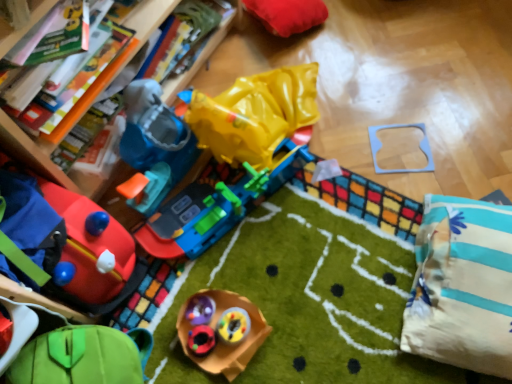
Locate an element on the screen. This screenshot has width=512, height=384. green fabric toy at lower left, positioned as the 1th toy in bottom-to-top order is located at coordinates (83, 356).

How much space does wooden puzzle piece at upper center, the 2th toy in the top-to-bottom sequence, occupy vertically?

2.56 centimeters.

The height and width of the screenshot is (384, 512). What do you see at coordinates (222, 343) in the screenshot? I see `rubberized plastic toy at center, the fourth toy in the top-to-bottom sequence` at bounding box center [222, 343].

Describe the element at coordinates (287, 14) in the screenshot. I see `velvet red cushion at upper center, arranged as the first toy when viewed from the top` at that location.

The image size is (512, 384). In order to click on wooden bookshelf at upper left in this screenshot , I will do `click(32, 152)`.

From the image's perspective, which is above, rubberized plastic toy at center, the fourth toy in the bottom-to-top sequence, or green fabric toy at lower left, positioned as the 1th toy in bottom-to-top order?

rubberized plastic toy at center, the fourth toy in the bottom-to-top sequence, is shown above in the image.

Which point is more distant from viewer, (231, 299) or (147, 353)?

The point (231, 299) is farther from the camera.

In the scene shown: How distant is rubberized plastic toy at center, the fourth toy in the bottom-to-top sequence, from green fabric toy at lower left, positioned as the 1th toy in bottom-to-top order?

8.76 inches.

The width and height of the screenshot is (512, 384). In order to click on pillow that is above the rubberized plastic toy at center, the fourth toy in the bottom-to-top sequence (from the image's perspective) in this screenshot , I will do `click(462, 286)`.

In the image, is rubberized plastic toy at center, the fourth toy in the bottom-to-top sequence, on the left side or the right side of white striped pillow at lower right?

rubberized plastic toy at center, the fourth toy in the bottom-to-top sequence, is to the left of white striped pillow at lower right.

Does rubberized plastic toy at center, the fourth toy in the bottom-to-top sequence, lie in front of white striped pillow at lower right?

No, rubberized plastic toy at center, the fourth toy in the bottom-to-top sequence, is further to the viewer.

Would you say rubberized plastic toy at center, the fourth toy in the bottom-to-top sequence, is inside or outside white striped pillow at lower right?

The correct answer is: outside.

From the image's perspective, is wooden bookshelf at upper left positioned above or below velvet red cushion at upper center, arranged as the first toy when viewed from the top?

wooden bookshelf at upper left is situated lower than velvet red cushion at upper center, arranged as the first toy when viewed from the top, in the image.

From a real-world perspective, is wooden bookshelf at upper left over velvet red cushion at upper center, marked as the seventh toy in a bottom-to-top arrangement?

Yes, from a real-world perspective, wooden bookshelf at upper left is on top of velvet red cushion at upper center, marked as the seventh toy in a bottom-to-top arrangement.

Between wooden bookshelf at upper left and velvet red cushion at upper center, marked as the seventh toy in a bottom-to-top arrangement, which one has smaller size?

Smaller between the two is velvet red cushion at upper center, marked as the seventh toy in a bottom-to-top arrangement.

Which point is more distant from viewer, (47, 141) or (270, 31)?

Point (270, 31)

Between point (23, 367) and point (433, 198), which one is positioned behind?

The point (433, 198) is farther.

Considering the sizes of green fabric toy at lower left, positioned as the 1th toy in bottom-to-top order, and white striped pillow at lower right in the image, is green fabric toy at lower left, positioned as the 1th toy in bottom-to-top order, bigger or smaller than white striped pillow at lower right?

Considering their sizes, green fabric toy at lower left, positioned as the 1th toy in bottom-to-top order, takes up less space than white striped pillow at lower right.

From the image's perspective, is green fabric toy at lower left, positioned as the 1th toy in bottom-to-top order, under white striped pillow at lower right?

Yes, from the image's perspective, green fabric toy at lower left, positioned as the 1th toy in bottom-to-top order, is below white striped pillow at lower right.

Which object is positioned more to the left, green fabric toy at lower left, positioned as the 1th toy in bottom-to-top order, or white striped pillow at lower right?

Positioned to the left is green fabric toy at lower left, positioned as the 1th toy in bottom-to-top order.

The width and height of the screenshot is (512, 384). I want to click on the 3rd toy above the rubberized plastic toy at center, the fourth toy in the bottom-to-top sequence (from the image's perspective), so click(287, 14).

Between velvet red cushion at upper center, arranged as the first toy when viewed from the top, and rubberized plastic toy at center, the fourth toy in the top-to-bottom sequence, which one appears on the left side from the viewer's perspective?

rubberized plastic toy at center, the fourth toy in the top-to-bottom sequence.

How distant is velvet red cushion at upper center, arranged as the first toy when viewed from the top, from rubberized plastic toy at center, the fourth toy in the top-to-bottom sequence?

velvet red cushion at upper center, arranged as the first toy when viewed from the top, is 36.10 inches away from rubberized plastic toy at center, the fourth toy in the top-to-bottom sequence.

From the image's perspective, is velvet red cushion at upper center, arranged as the first toy when viewed from the top, positioned above or below rubberized plastic toy at center, the fourth toy in the bottom-to-top sequence?

velvet red cushion at upper center, arranged as the first toy when viewed from the top, is above rubberized plastic toy at center, the fourth toy in the bottom-to-top sequence.

From a real-world perspective, which object rests below the other?

In real-world perspective, rubberized red car at lower left, the fifth toy from the bottom, is lower.

Which object is positioned more to the left, rubberized red car at lower left, arranged as the third toy when viewed from the top, or wooden bookshelf at upper left?

rubberized red car at lower left, arranged as the third toy when viewed from the top.

The image size is (512, 384). What are the coordinates of `toy on the left side of green fabric toy at lower left, the 7th toy in the top-to-bottom sequence` in the screenshot? It's located at pos(70,243).

Between green fabric toy at lower left, positioned as the 1th toy in bottom-to-top order, and rubberized red car at lower left, the fifth toy from the bottom, which one has smaller width?

green fabric toy at lower left, positioned as the 1th toy in bottom-to-top order, is thinner.

From the image's perspective, is green fabric toy at lower left, positioned as the 1th toy in bottom-to-top order, above or below rubberized red car at lower left, the fifth toy from the bottom?

From the image's perspective, green fabric toy at lower left, positioned as the 1th toy in bottom-to-top order, appears below rubberized red car at lower left, the fifth toy from the bottom.

From a real-world perspective, does green fabric toy at lower left, the 7th toy in the top-to-bottom sequence, sit lower than rubberized red car at lower left, the fifth toy from the bottom?

Yes.

In order to click on the 3rd toy positioned above the green fabric toy at lower left, positioned as the 1th toy in bottom-to-top order (from the image's perspective) in this screenshot , I will do `click(222, 343)`.

From a real-world perspective, count 3rd toys downward from the white striped pillow at lower right and point to it. Please provide its 2D coordinates.

[(222, 343)]

Considering their positions, is rubberized plastic toy at center, the 5th toy when ordered from top to bottom, positioned further to rubberized plastic toy at center, the fourth toy in the bottom-to-top sequence, than wooden puzzle piece at upper center, the 2th toy in the top-to-bottom sequence?

wooden puzzle piece at upper center, the 2th toy in the top-to-bottom sequence.

In the scene shown: Looking at the image, which one is located closer to rubberized plastic toy at center, placed as the second toy when sorted from bottom to top, rubberized plastic toy at center, the 5th toy when ordered from top to bottom, or wooden bookshelf at upper left?

rubberized plastic toy at center, the 5th toy when ordered from top to bottom, is closer to rubberized plastic toy at center, placed as the second toy when sorted from bottom to top.

Based on their spatial positions, is white striped pillow at lower right or wooden bookshelf at upper left further from rubberized plastic toy at center, the fourth toy in the bottom-to-top sequence?

The object further to rubberized plastic toy at center, the fourth toy in the bottom-to-top sequence, is wooden bookshelf at upper left.

When comparing their distances from rubberized red car at lower left, arranged as the third toy when viewed from the top, does rubberized plastic toy at center, the fourth toy in the top-to-bottom sequence, or wooden bookshelf at upper left seem further?

The object further to rubberized red car at lower left, arranged as the third toy when viewed from the top, is rubberized plastic toy at center, the fourth toy in the top-to-bottom sequence.

Looking at the image, which one is located further to rubberized red car at lower left, arranged as the third toy when viewed from the top, rubberized plastic toy at center, the 5th toy when ordered from top to bottom, or rubberized plastic toy at center, the sixth toy from the top?

rubberized plastic toy at center, the 5th toy when ordered from top to bottom.

Considering their positions, is rubberized red car at lower left, the fifth toy from the bottom, positioned closer to wooden puzzle piece at upper center, the 6th toy when ordered from bottom to top, than rubberized plastic toy at center, placed as the second toy when sorted from bottom to top?

The object closer to wooden puzzle piece at upper center, the 6th toy when ordered from bottom to top, is rubberized plastic toy at center, placed as the second toy when sorted from bottom to top.

Which object lies further to the anchor point rubberized plastic toy at center, the fourth toy in the bottom-to-top sequence, wooden puzzle piece at upper center, the 2th toy in the top-to-bottom sequence, or green fabric toy at lower left, positioned as the 1th toy in bottom-to-top order?

wooden puzzle piece at upper center, the 2th toy in the top-to-bottom sequence, is further to rubberized plastic toy at center, the fourth toy in the bottom-to-top sequence.

When comparing their distances from wooden puzzle piece at upper center, the 6th toy when ordered from bottom to top, does rubberized red car at lower left, arranged as the third toy when viewed from the top, or rubberized plastic toy at center, the 5th toy when ordered from top to bottom, seem further?

rubberized red car at lower left, arranged as the third toy when viewed from the top, lies further to wooden puzzle piece at upper center, the 6th toy when ordered from bottom to top, than the other object.

The width and height of the screenshot is (512, 384). Find the location of `toy between green fabric toy at lower left, the 7th toy in the top-to-bottom sequence, and rubberized plastic toy at center, the fourth toy in the bottom-to-top sequence`. toy between green fabric toy at lower left, the 7th toy in the top-to-bottom sequence, and rubberized plastic toy at center, the fourth toy in the bottom-to-top sequence is located at coordinates coord(201,340).

The image size is (512, 384). Find the location of `bookcase that lies between velvet red cushion at upper center, marked as the seventh toy in a bottom-to-top arrangement, and rubberized plastic toy at center, the fourth toy in the top-to-bottom sequence, from top to bottom`. bookcase that lies between velvet red cushion at upper center, marked as the seventh toy in a bottom-to-top arrangement, and rubberized plastic toy at center, the fourth toy in the top-to-bottom sequence, from top to bottom is located at coordinates (32, 152).

Identify the location of bookcase between velvet red cushion at upper center, marked as the seventh toy in a bottom-to-top arrangement, and rubberized plastic toy at center, the 5th toy when ordered from top to bottom, in the vertical direction. The height and width of the screenshot is (384, 512). (32, 152).

Locate an element on the screen. bookcase situated between rubberized red car at lower left, arranged as the third toy when viewed from the top, and wooden puzzle piece at upper center, the 2th toy in the top-to-bottom sequence, from left to right is located at coordinates (32, 152).